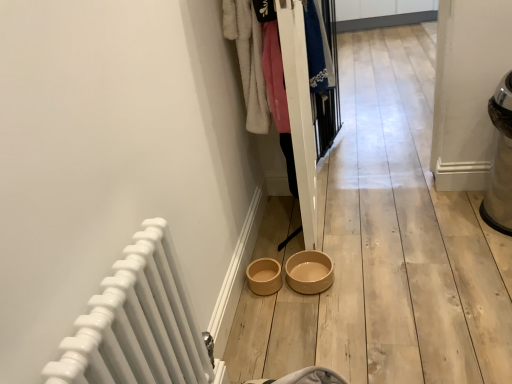
Where is `free location above white glossy radiator at lower left (from a real-world perspective)`? The width and height of the screenshot is (512, 384). free location above white glossy radiator at lower left (from a real-world perspective) is located at coordinates (117, 279).